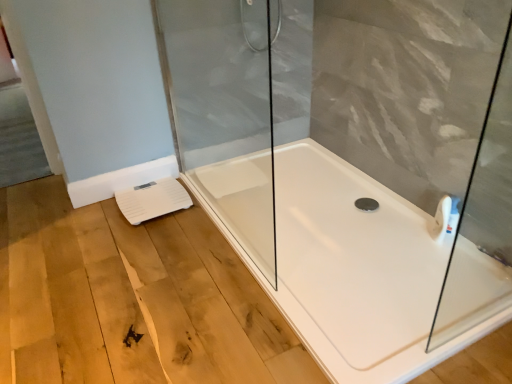
This screenshot has height=384, width=512. Identify the location of free spot to the left of white plastic scale at lower left. (92, 215).